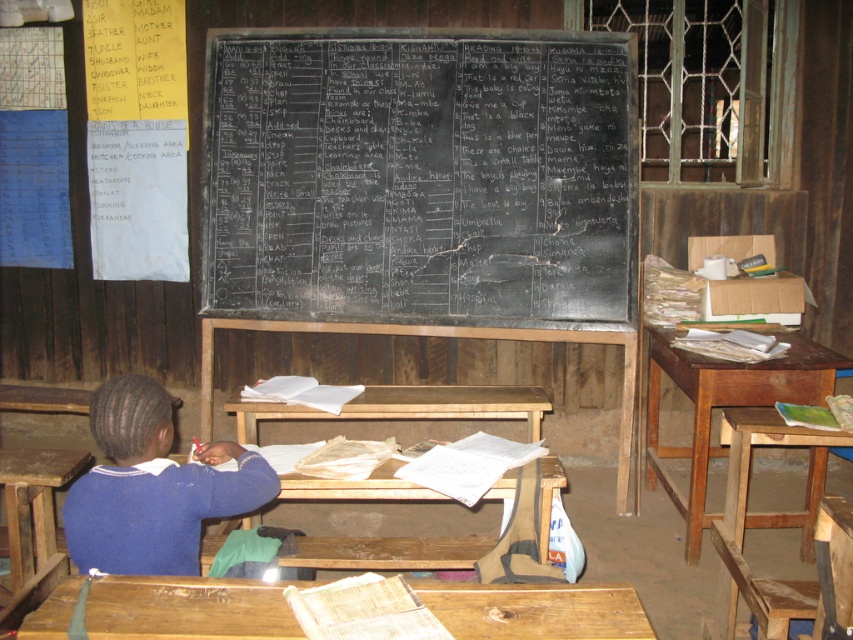
Question: Can you confirm if black chalkboard at center is positioned below blue sweater at center?

Choices:
 (A) no
 (B) yes

Answer: (A)

Question: Is blue sweater at center positioned in front of wooden stool at lower right?

Choices:
 (A) no
 (B) yes

Answer: (B)

Question: Which of the following is the farthest from the observer?

Choices:
 (A) (471, 600)
 (B) (223, 125)

Answer: (B)

Question: Estimate the real-world distances between objects in this image. Which object is closer to the wooden stool at lower right?

Choices:
 (A) brown wooden table at right
 (B) wooden table at center

Answer: (A)

Question: Which of the following is the closest to the observer?

Choices:
 (A) wooden stool at lower right
 (B) wooden desk at lower center
 (C) black chalkboard at center
 (D) blue sweater at center

Answer: (B)

Question: Is black chalkboard at center to the left of wooden table at center from the viewer's perspective?

Choices:
 (A) yes
 (B) no

Answer: (B)